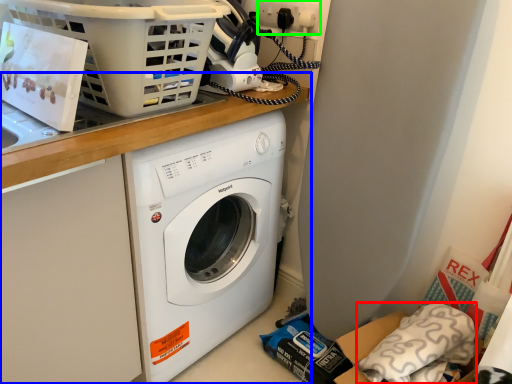
Question: Based on their relative distances, which object is nearer to pillow (highlighted by a red box)? Choose from counter top (highlighted by a blue box) and electric outlet (highlighted by a green box).

Choices:
 (A) counter top
 (B) electric outlet

Answer: (A)